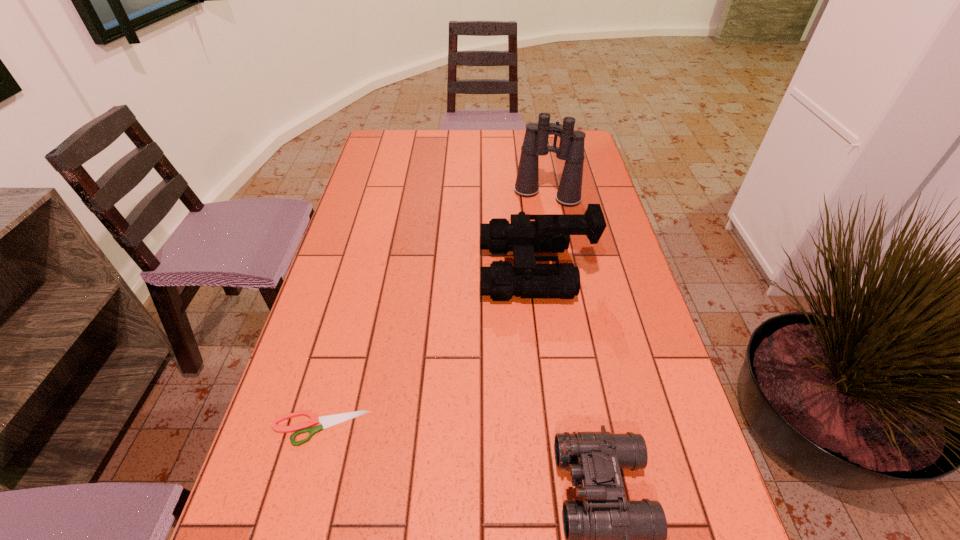
I want to click on the farthest binoculars, so click(571, 148).

Locate an element on the screen. the farthest object is located at coordinates (571, 148).

Locate an element on the screen. The image size is (960, 540). the third shortest object is located at coordinates (551, 232).

This screenshot has height=540, width=960. I want to click on the third nearest object, so click(x=551, y=232).

Locate an element on the screen. The width and height of the screenshot is (960, 540). the shortest object is located at coordinates (328, 421).

Locate an element on the screen. The image size is (960, 540). the leftmost object is located at coordinates (328, 421).

The image size is (960, 540). I want to click on free space located on the back of the tallest binoculars, so click(541, 166).

The width and height of the screenshot is (960, 540). I want to click on vacant region located 0.300m on the front lenses of the second tallest object, so click(369, 270).

Identify the location of free point located 0.120m on the front lenses of the second tallest object. The image size is (960, 540). (436, 270).

This screenshot has height=540, width=960. Find the location of `vacant space located on the front lenses of the second tallest object`. vacant space located on the front lenses of the second tallest object is located at coordinates (440, 270).